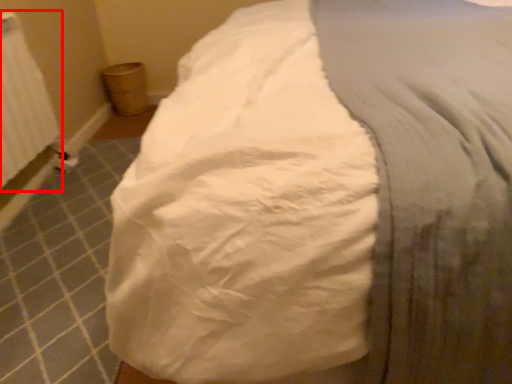
Question: From the image's perspective, what is the correct spatial positioning of radiator (annotated by the red box) in reference to sheet?

Choices:
 (A) below
 (B) above

Answer: (B)